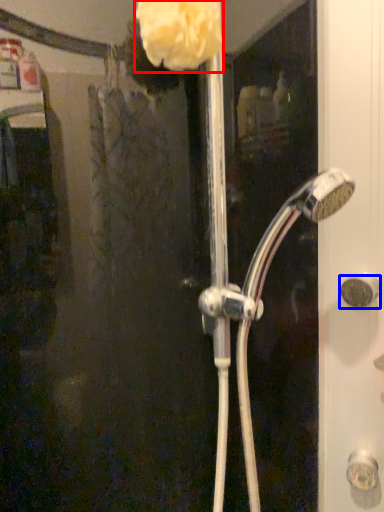
Question: Which object is further to the camera taking this photo, flower (highlighted by a red box) or door handle (highlighted by a blue box)?

Choices:
 (A) flower
 (B) door handle

Answer: (B)